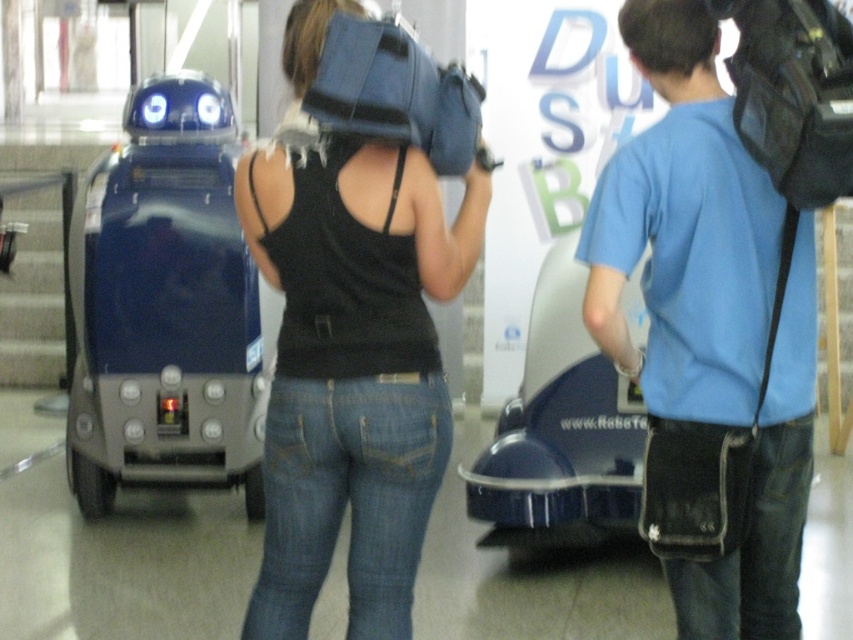
Is blue matte shirt at center taller than shiny blue robot at left?

Incorrect, blue matte shirt at center's height is not larger of shiny blue robot at left's.

Does blue matte shirt at center lie behind shiny blue robot at left?

No, blue matte shirt at center is closer to the viewer.

Describe the element at coordinates (682, 228) in the screenshot. This screenshot has width=853, height=640. I see `blue matte shirt at center` at that location.

Where is `blue matte shirt at center`? This screenshot has height=640, width=853. blue matte shirt at center is located at coordinates (682, 228).

Does black matte tank top at center appear over shiny blue robot at left?

Incorrect, black matte tank top at center is not positioned above shiny blue robot at left.

Who is higher up, black matte tank top at center or shiny blue robot at left?

shiny blue robot at left is higher up.

The image size is (853, 640). Describe the element at coordinates (352, 371) in the screenshot. I see `black matte tank top at center` at that location.

I want to click on black matte tank top at center, so click(x=352, y=371).

Which of these two, black matte tank top at center or blue matte shirt at center, stands taller?

black matte tank top at center

This screenshot has width=853, height=640. What do you see at coordinates (352, 371) in the screenshot? I see `black matte tank top at center` at bounding box center [352, 371].

Where is `black matte tank top at center`? Image resolution: width=853 pixels, height=640 pixels. black matte tank top at center is located at coordinates (352, 371).